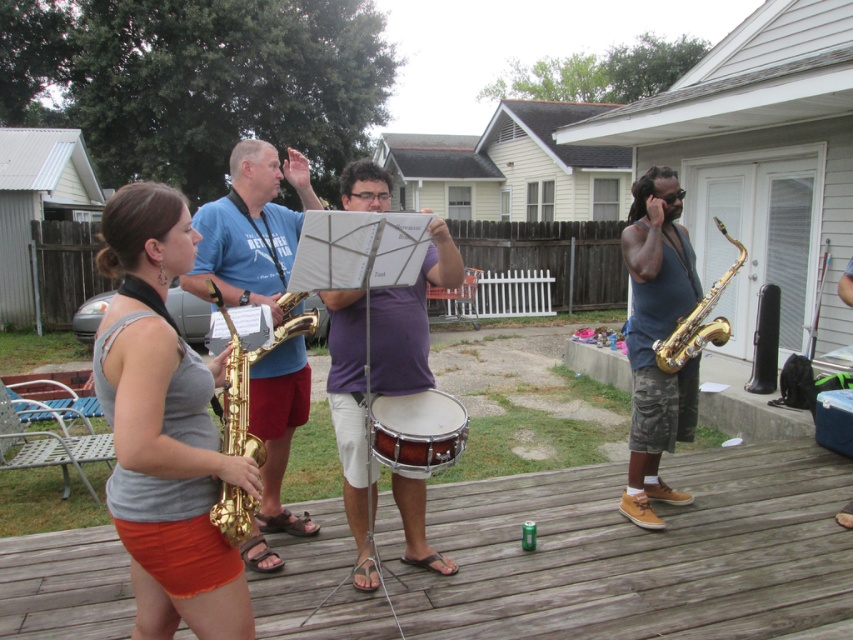
Image resolution: width=853 pixels, height=640 pixels. In order to click on camouflage shorts at right in this screenshot , I will do `click(657, 337)`.

Locate an element on the screen. Image resolution: width=853 pixels, height=640 pixels. camouflage shorts at right is located at coordinates (657, 337).

Where is `camouflage shorts at right`? The height and width of the screenshot is (640, 853). camouflage shorts at right is located at coordinates (657, 337).

Who is more distant from viewer, [235,432] or [677,321]?

Point [677,321]

How distant is gold shiny saxophone at center from gold shiny saxophone at right?

Answer: gold shiny saxophone at center is 2.19 meters from gold shiny saxophone at right.

Measure the distance between point (247, 355) and camera.

Point (247, 355) and camera are 2.24 meters apart.

Identify the location of gold shiny saxophone at center. (236, 390).

Who is higher up, mahogany wood snare drum at center or gold shiny saxophone at right?

Positioned higher is gold shiny saxophone at right.

Which is behind, point (386, 460) or point (720, 332)?

Point (720, 332)

This screenshot has height=640, width=853. What are the coordinates of `mahogany wood snare drum at center` in the screenshot? It's located at (416, 429).